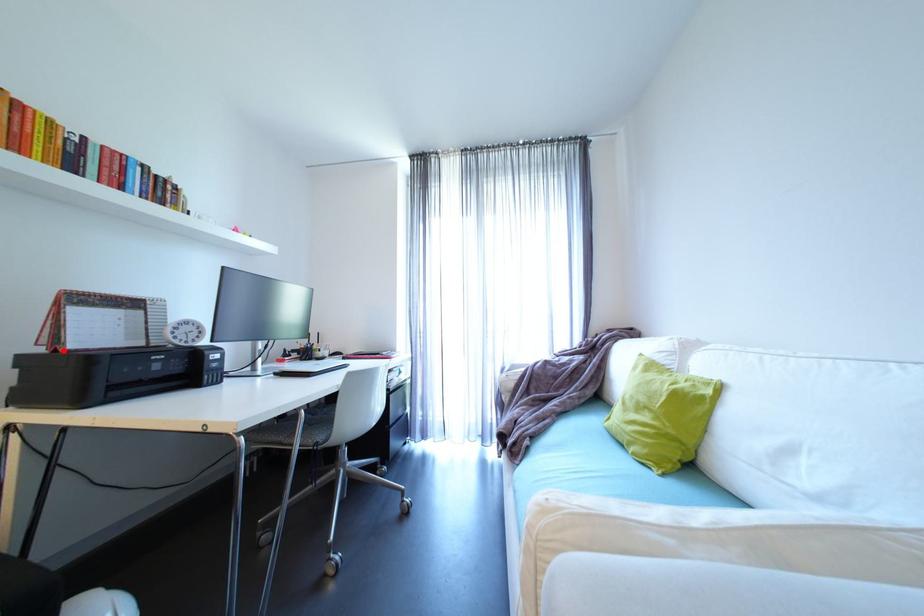
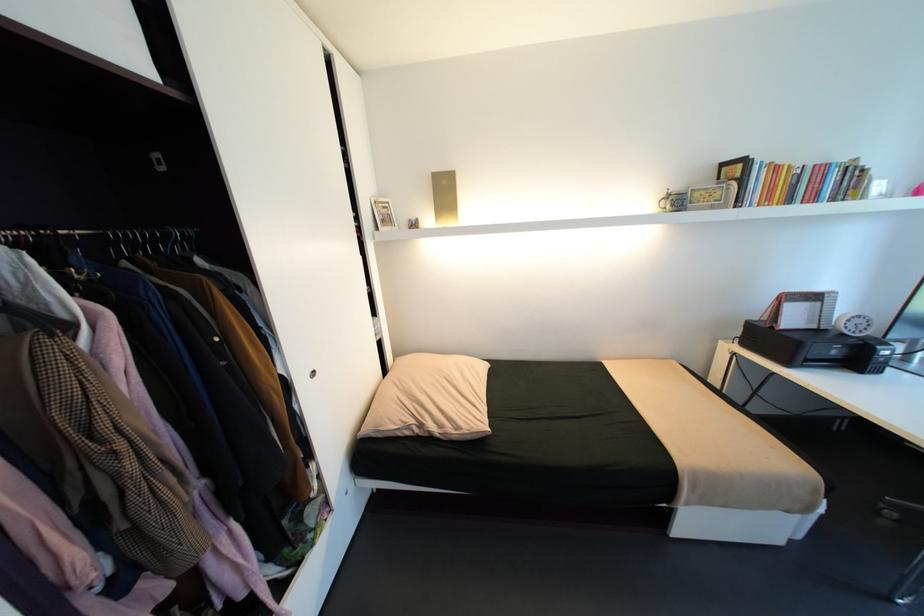
Locate, in the second image, the point that corresponds to the highlighted location in the first image.

(779, 328)